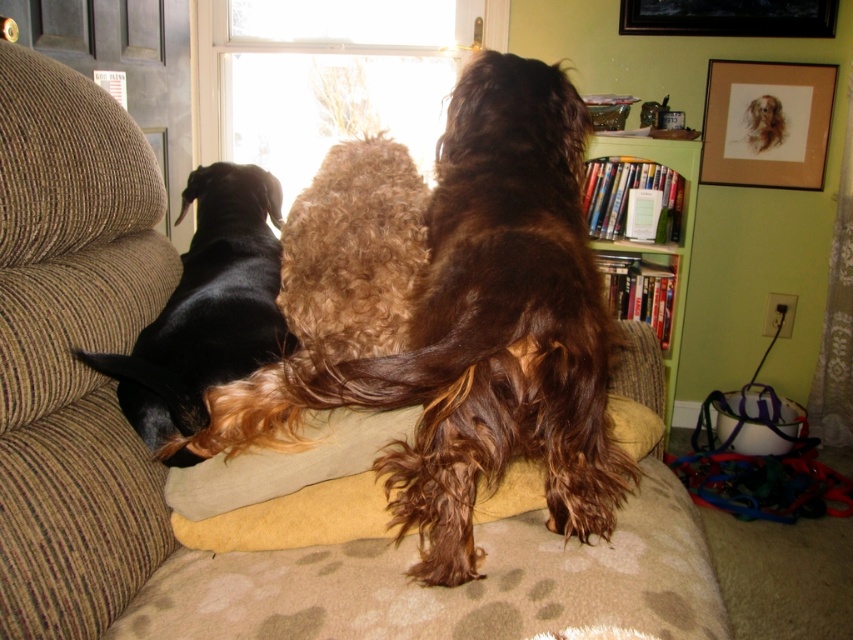
Is curly golden fur at center to the left of green wood bookshelf at upper right from the viewer's perspective?

Indeed, curly golden fur at center is positioned on the left side of green wood bookshelf at upper right.

Which is above, curly golden fur at center or green wood bookshelf at upper right?

green wood bookshelf at upper right is higher up.

Describe the element at coordinates (354, 252) in the screenshot. Image resolution: width=853 pixels, height=640 pixels. I see `curly golden fur at center` at that location.

The height and width of the screenshot is (640, 853). What are the coordinates of `curly golden fur at center` in the screenshot? It's located at (354, 252).

Based on the photo, does transparent glass window at upper center appear on the right side of green wood bookshelf at upper right?

Incorrect, transparent glass window at upper center is not on the right side of green wood bookshelf at upper right.

Does transparent glass window at upper center have a smaller size compared to green wood bookshelf at upper right?

Incorrect, transparent glass window at upper center is not smaller in size than green wood bookshelf at upper right.

What are the coordinates of `transparent glass window at upper center` in the screenshot? It's located at (331, 76).

Who is more distant from viewer, (x=294, y=65) or (x=202, y=381)?

The point (x=294, y=65) is behind.

Can you confirm if transparent glass window at upper center is shorter than black shiny dog at left?

No, transparent glass window at upper center is not shorter than black shiny dog at left.

Who is more distant from viewer, (358, 44) or (225, 284)?

Point (358, 44)

In order to click on transparent glass window at upper center in this screenshot , I will do `click(331, 76)`.